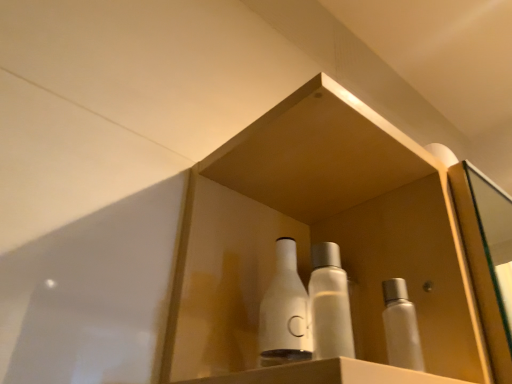
Question: Could you tell me if white glossy bottles at center is facing translucent plastic bottle at center, the second bottle positioned from the right?

Choices:
 (A) yes
 (B) no

Answer: (A)

Question: Is white glossy bottles at center beside translucent plastic bottle at center, the second bottle viewed from the left?

Choices:
 (A) yes
 (B) no

Answer: (B)

Question: From a real-world perspective, does white glossy bottles at center sit lower than translucent plastic bottle at center, the second bottle viewed from the left?

Choices:
 (A) yes
 (B) no

Answer: (B)

Question: Is white glossy bottles at center oriented away from translucent plastic bottle at center, the second bottle viewed from the left?

Choices:
 (A) no
 (B) yes

Answer: (A)

Question: From the image's perspective, would you say white glossy bottles at center is shown under translucent plastic bottle at center, the second bottle viewed from the left?

Choices:
 (A) yes
 (B) no

Answer: (B)

Question: Would you consider white glossy bottles at center to be distant from translucent plastic bottle at center, the second bottle viewed from the left?

Choices:
 (A) no
 (B) yes

Answer: (A)

Question: Is white glossy bottles at center turned away from white matte bottle at right, which appears as the first bottle when viewed from the right?

Choices:
 (A) yes
 (B) no

Answer: (B)

Question: Is white glossy bottles at center to the left of white matte bottle at right, which appears as the first bottle when viewed from the right, from the viewer's perspective?

Choices:
 (A) no
 (B) yes

Answer: (B)

Question: From a real-world perspective, is white glossy bottles at center physically above white matte bottle at right, which appears as the first bottle when viewed from the right?

Choices:
 (A) no
 (B) yes

Answer: (B)

Question: Are white glossy bottles at center and white matte bottle at right, which is the 3th bottle from left to right, far apart?

Choices:
 (A) no
 (B) yes

Answer: (A)

Question: Is white glossy bottles at center at the right side of white matte bottle at right, which appears as the first bottle when viewed from the right?

Choices:
 (A) yes
 (B) no

Answer: (B)

Question: Could you tell me if white glossy bottles at center is turned towards white matte bottle at right, which is the 3th bottle from left to right?

Choices:
 (A) yes
 (B) no

Answer: (A)

Question: Can you confirm if white matte bottle at right, which appears as the first bottle when viewed from the right, is positioned to the right of translucent plastic bottle at center, the second bottle viewed from the left?

Choices:
 (A) no
 (B) yes

Answer: (B)